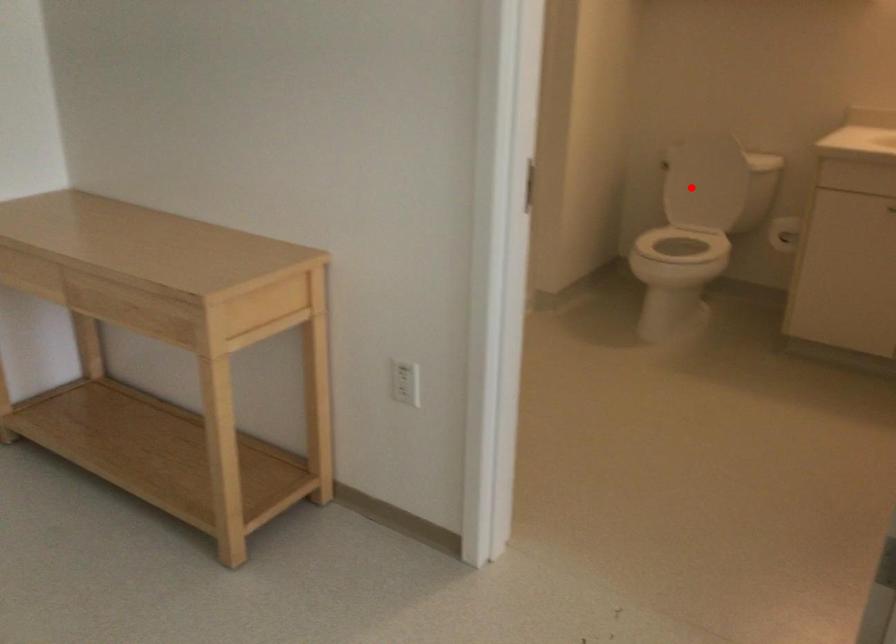
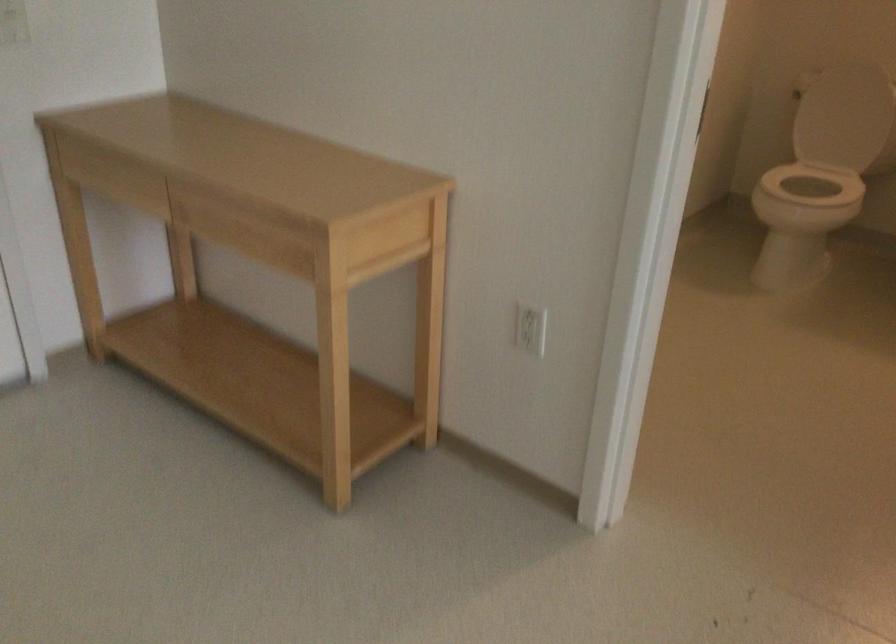
Question: I am providing you with two images of the same scene from different viewpoints. A red point is shown in image1. For the corresponding object point in image2, is it positioned nearer or farther from the camera?

Choices:
 (A) Nearer
 (B) Farther

Answer: (A)